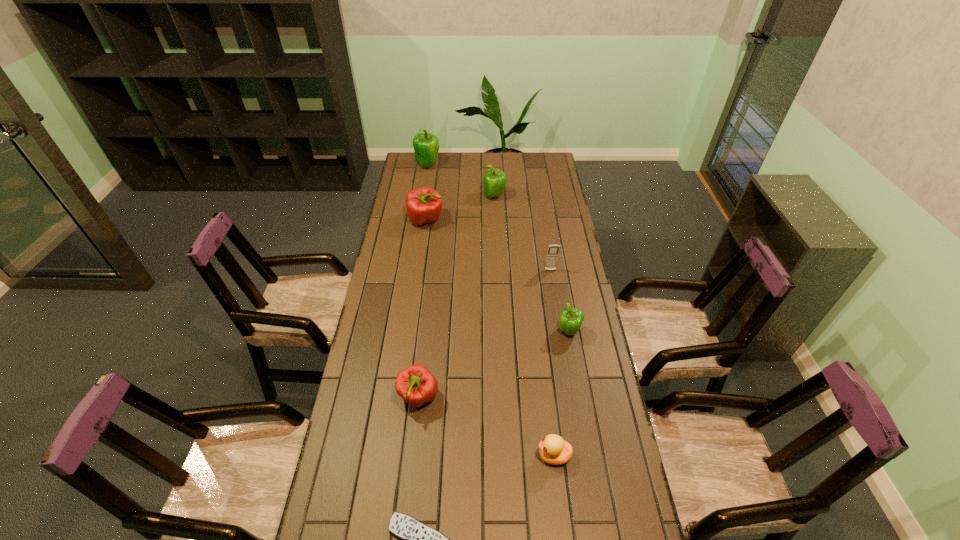
The height and width of the screenshot is (540, 960). I want to click on the farthest bell pepper, so click(426, 145).

What are the coordinates of `the biggest green bell pepper` in the screenshot? It's located at (426, 145).

Where is `the second bell pepper from right to left`? The width and height of the screenshot is (960, 540). the second bell pepper from right to left is located at coordinates (494, 180).

Locate an element on the screen. the second biggest green bell pepper is located at coordinates (494, 180).

You are a GUI agent. You are given a task and a screenshot of the screen. Output one action in this format:
    pyautogui.click(x=<x>, y=<y>)
    Task: Click on the third nearest bell pepper
    This screenshot has height=540, width=960.
    Given the screenshot: What is the action you would take?
    point(423,205)

Locate an element on the screen. This screenshot has width=960, height=540. the farther pink bell pepper is located at coordinates (423, 205).

This screenshot has width=960, height=540. Identify the location of cellular telephone. (551, 260).

Find the location of a particular element. Image resolution: width=960 pixels, height=540 pixels. the fourth farthest object is located at coordinates (551, 260).

I want to click on the nearest green bell pepper, so click(571, 318).

This screenshot has width=960, height=540. Identify the location of the rightmost bell pepper. (571, 318).